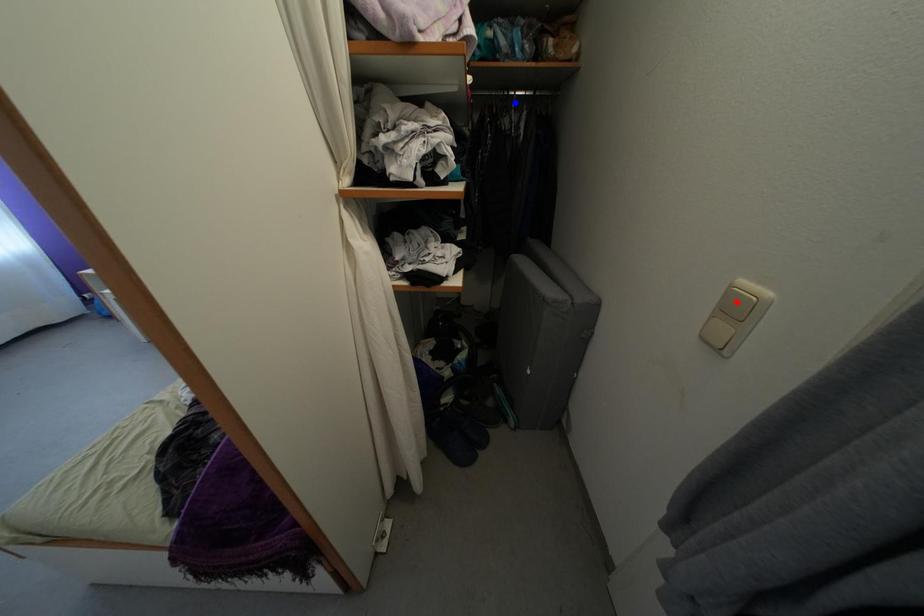
Question: Which of the two points in the image is closer to the camera?

Choices:
 (A) Blue point is closer.
 (B) Red point is closer.

Answer: (B)